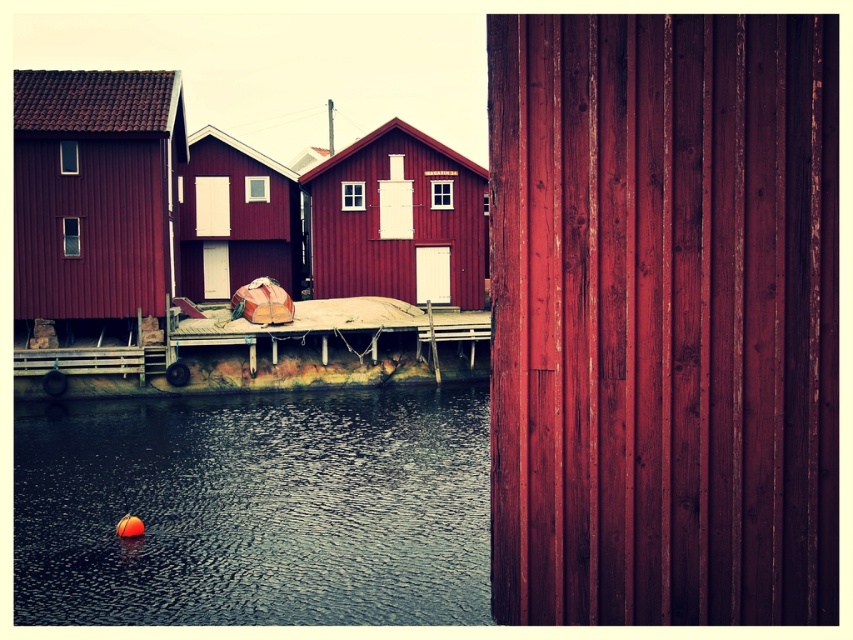
You are a visitor who wants to take a photo of the matte wood hut at center and the matte red wooden hut at center. Which one should you stand closer to the water to capture in your photo?

The matte wood hut at center has a lesser height compared to the matte red wooden hut at center, so you should stand closer to the water to capture the matte wood hut at center in your photo because its lower height would require a closer perspective to frame properly.

You are standing on the wooden dock at center and want to reach the smooth dark water at lower left. Can you safely walk directly to the water from the dock without needing to jump?

The distance between the smooth dark water at lower left and the wooden dock at center is 4.61 meters, so yes, you can safely walk directly to the water from the dock without needing to jump since the distance is manageable for walking.

Based on the photo, you are standing on the wooden pier and looking towards the smooth dark water at lower left and the matte wood hut at left. Which object is positioned lower in the scene?

The smooth dark water at lower left is positioned lower than the matte wood hut at left in the scene.